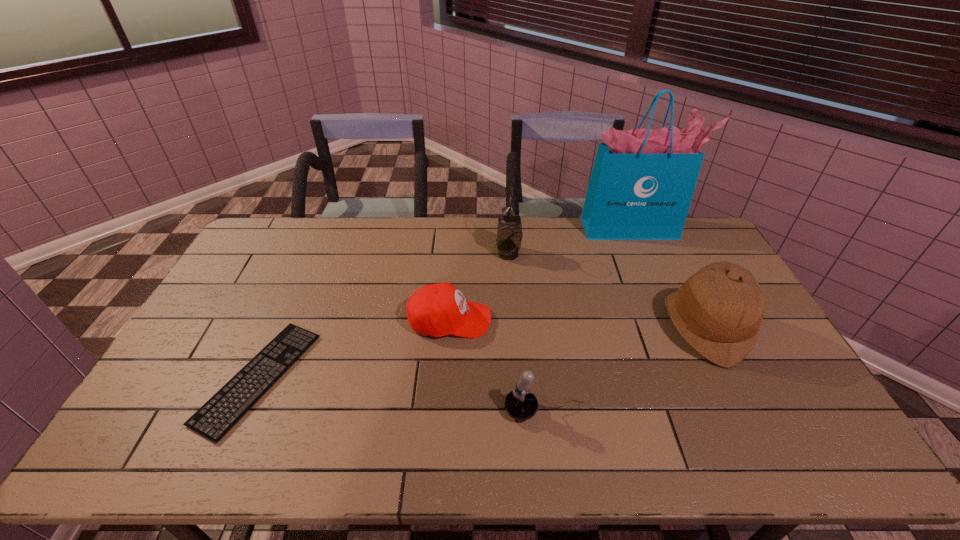
Find the location of a particular element. Image resolution: width=960 pixels, height=540 pixels. the closest object to the oil lamp is located at coordinates (437, 310).

Image resolution: width=960 pixels, height=540 pixels. I want to click on blank space that satisfies the following two spatial constraints: 1. on the back side of the second farthest object; 2. on the right side of the tallest object, so click(x=507, y=228).